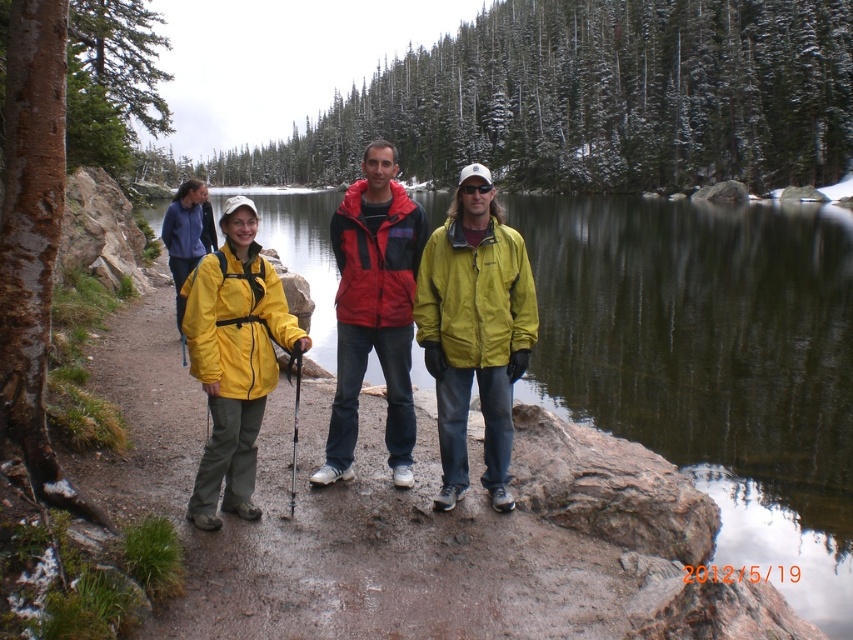
You are standing at the edge of the lake and want to throw a stone into the water. If you can throw a stone 40 feet, will it reach the transparent water at center?

The transparent water at center is 43.39 feet away from the viewer. Since your throwing distance is 40 feet, the stone will not reach the transparent water at center.

You are a photographer trying to capture the group of hikers by the lake. You want to ensure that both the matte yellow jacket at center and the yellow matte jacket at left are clearly visible in your photo. Based on their positions, which jacket is closer to the camera?

The matte yellow jacket at center is closer to the camera because the yellow matte jacket at left is positioned behind it.